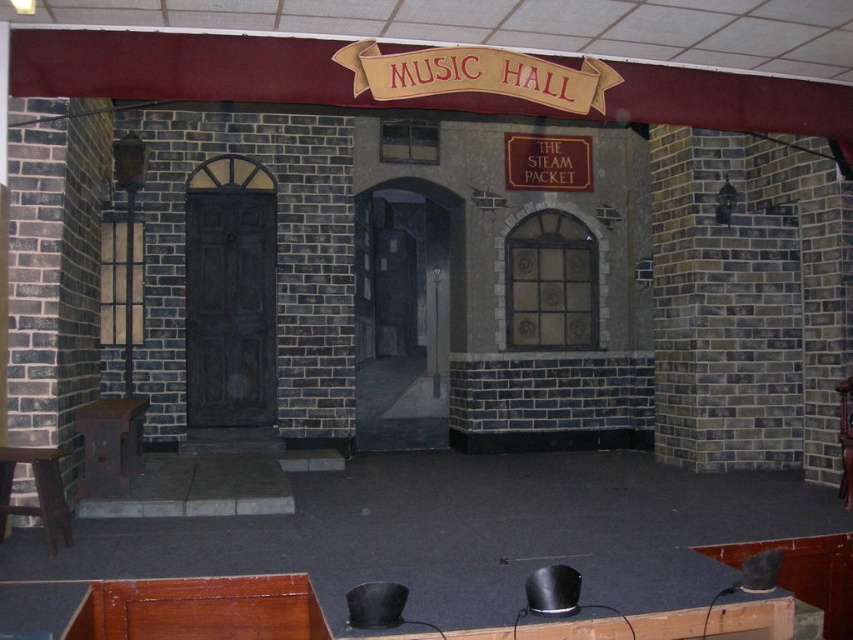
Question: Based on their relative distances, which object is nearer to the rustic wood stool at lower left?

Choices:
 (A) wooden stool at lower left
 (B) smooth wooden floor at center

Answer: (A)

Question: Observing the image, what is the correct spatial positioning of smooth wooden floor at center in reference to rustic wood stool at lower left?

Choices:
 (A) above
 (B) below

Answer: (B)

Question: Does wooden stool at lower left appear under wooden stool at center?

Choices:
 (A) no
 (B) yes

Answer: (B)

Question: Observing the image, what is the correct spatial positioning of rustic wood stool at lower left in reference to wooden stool at center?

Choices:
 (A) left
 (B) right

Answer: (A)

Question: Considering the real-world distances, which object is closest to the rustic wood stool at lower left?

Choices:
 (A) wooden stool at center
 (B) wooden stool at lower left
 (C) smooth wooden floor at center

Answer: (B)

Question: Which of the following is the closest to the observer?

Choices:
 (A) rustic wood stool at lower left
 (B) wooden stool at lower left
 (C) smooth wooden floor at center
 (D) wooden stool at center

Answer: (B)